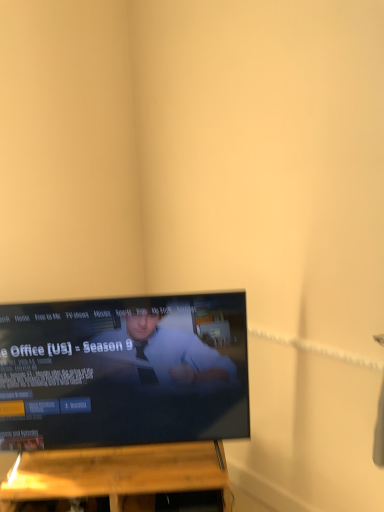
Where is `free region under black glossy tv at center (from a real-world perspective)`? This screenshot has height=512, width=384. free region under black glossy tv at center (from a real-world perspective) is located at coordinates (127, 458).